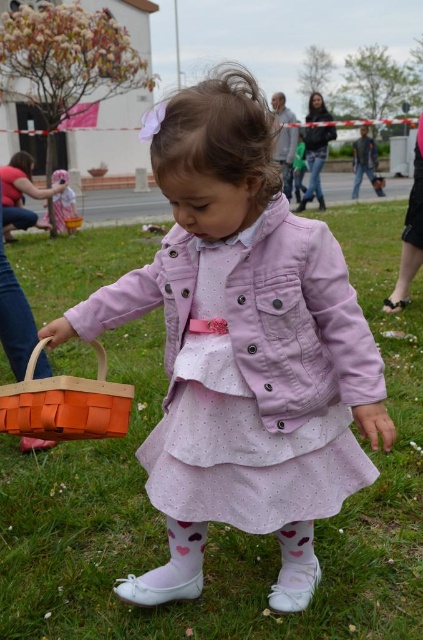
Question: Is green grass at center bigger than orange woven basket at lower left?

Choices:
 (A) no
 (B) yes

Answer: (B)

Question: Which point appears closest to the camera in this image?

Choices:
 (A) (87, 476)
 (B) (128, 422)

Answer: (B)

Question: Based on their relative distances, which object is nearer to the orange woven basket at lower left?

Choices:
 (A) green grass at center
 (B) matte pink jacket at center

Answer: (B)

Question: Among these objects, which one is farthest from the camera?

Choices:
 (A) matte pink jacket at center
 (B) green grass at center

Answer: (B)

Question: Does green grass at center have a smaller size compared to orange woven basket at lower left?

Choices:
 (A) yes
 (B) no

Answer: (B)

Question: From the image, what is the correct spatial relationship of green grass at center in relation to orange woven basket at lower left?

Choices:
 (A) below
 (B) above

Answer: (A)